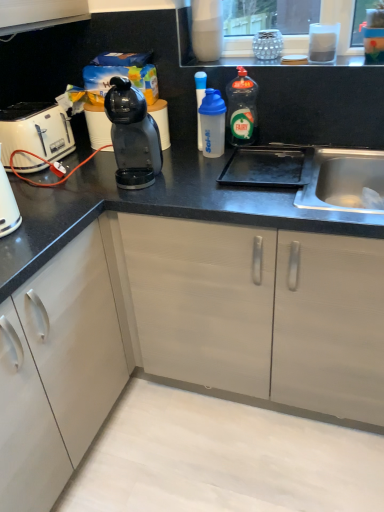
The height and width of the screenshot is (512, 384). Identify the location of transparent plastic bottle at center, which is the third bottle in left-to-right order. (242, 108).

What is the approximate width of transparent plastic bottle at center, the first bottle from the right?

3.23 inches.

The image size is (384, 512). Find the location of `transparent plastic shaker at center, marked as the 3th bottle in a right-to-left arrangement`. transparent plastic shaker at center, marked as the 3th bottle in a right-to-left arrangement is located at coordinates (200, 102).

Consider the image. Measure the distance between point (152, 148) and camera.

Point (152, 148) and camera are 4.61 feet apart.

The width and height of the screenshot is (384, 512). What are the coordinates of `transparent plastic bottle at center, the first bottle from the right` in the screenshot? It's located at (242, 108).

The image size is (384, 512). In the image, there is a white plastic shaker at center, which is counted as the second bottle, starting from the left. Identify the location of home appliance below it (from the image's perspective). (36, 131).

Considering the relative positions of white plastic shaker at center, the 2th bottle viewed from the right, and white plastic toaster at left in the image provided, is white plastic shaker at center, the 2th bottle viewed from the right, to the left or to the right of white plastic toaster at left?

Based on their positions, white plastic shaker at center, the 2th bottle viewed from the right, is located to the right of white plastic toaster at left.

Choose the correct answer: Is white plastic shaker at center, which is counted as the second bottle, starting from the left, inside white plastic toaster at left or outside it?

white plastic shaker at center, which is counted as the second bottle, starting from the left, is spatially situated outside white plastic toaster at left.

From the image's perspective, is white plastic shaker at center, which is counted as the second bottle, starting from the left, above or below white plastic toaster at left?

Based on their image positions, white plastic shaker at center, which is counted as the second bottle, starting from the left, is located above white plastic toaster at left.

Can we say transparent plastic shaker at center, marked as the 3th bottle in a right-to-left arrangement, lies outside black plastic coffee machine at center?

Yes, transparent plastic shaker at center, marked as the 3th bottle in a right-to-left arrangement, is not within black plastic coffee machine at center.

Can you confirm if transparent plastic shaker at center, which is the first bottle in left-to-right order, is thinner than black plastic coffee machine at center?

Yes.

Considering the points (204, 84) and (122, 89), which point is in front, point (204, 84) or point (122, 89)?

The point (122, 89) is closer to the camera.

Is transparent plastic shaker at center, which is the first bottle in left-to-right order, placed right next to black plastic coffee machine at center?

No.

Is white plastic shaker at center, which is counted as the second bottle, starting from the left, further to the viewer compared to transparent plastic bottle at center, the first bottle from the right?

No, it is not.

Considering the sizes of white plastic shaker at center, the 2th bottle viewed from the right, and transparent plastic bottle at center, the first bottle from the right, in the image, is white plastic shaker at center, the 2th bottle viewed from the right, taller or shorter than transparent plastic bottle at center, the first bottle from the right,?

In the image, white plastic shaker at center, the 2th bottle viewed from the right, appears to be shorter than transparent plastic bottle at center, the first bottle from the right.

Is white plastic shaker at center, the 2th bottle viewed from the right, not within transparent plastic bottle at center, which is the third bottle in left-to-right order?

Yes, white plastic shaker at center, the 2th bottle viewed from the right, is outside of transparent plastic bottle at center, which is the third bottle in left-to-right order.

How many degrees apart are the facing directions of white plastic shaker at center, the 2th bottle viewed from the right, and transparent plastic bottle at center, which is the third bottle in left-to-right order?

The angle between the facing direction of white plastic shaker at center, the 2th bottle viewed from the right, and the facing direction of transparent plastic bottle at center, which is the third bottle in left-to-right order, is 0.0054 degrees.

At what (x,y) coordinates should I click in order to perform the action: click on home appliance in front of the transparent plastic shaker at center, which is the first bottle in left-to-right order. Please return your answer as a coordinate pair (x, y). The image size is (384, 512). Looking at the image, I should click on (36, 131).

Consider the image. Could you measure the distance between transparent plastic shaker at center, marked as the 3th bottle in a right-to-left arrangement, and white plastic toaster at left?

They are 22.93 inches apart.

Can you confirm if transparent plastic shaker at center, which is the first bottle in left-to-right order, is taller than white plastic toaster at left?

Indeed, transparent plastic shaker at center, which is the first bottle in left-to-right order, has a greater height compared to white plastic toaster at left.

From the image's perspective, who appears lower, transparent plastic shaker at center, which is the first bottle in left-to-right order, or white plastic toaster at left?

white plastic toaster at left appears lower in the image.

Could you tell me if white plastic toaster at left is facing transparent plastic shaker at center, marked as the 3th bottle in a right-to-left arrangement?

Yes, white plastic toaster at left faces towards transparent plastic shaker at center, marked as the 3th bottle in a right-to-left arrangement.

Is white plastic toaster at left not within transparent plastic shaker at center, marked as the 3th bottle in a right-to-left arrangement?

Absolutely, white plastic toaster at left is external to transparent plastic shaker at center, marked as the 3th bottle in a right-to-left arrangement.

From a real-world perspective, which object rests below the other?

white plastic toaster at left is physically lower.

Does white plastic toaster at left appear on the right side of transparent plastic shaker at center, marked as the 3th bottle in a right-to-left arrangement?

Incorrect, white plastic toaster at left is not on the right side of transparent plastic shaker at center, marked as the 3th bottle in a right-to-left arrangement.

From the image's perspective, who appears lower, white plastic toaster at left or white plastic shaker at center, which is counted as the second bottle, starting from the left?

white plastic toaster at left is shown below in the image.

From a real-world perspective, is white plastic toaster at left positioned over white plastic shaker at center, the 2th bottle viewed from the right, based on gravity?

No, from a real-world perspective, white plastic toaster at left is not above white plastic shaker at center, the 2th bottle viewed from the right.

How far apart are white plastic toaster at left and white plastic shaker at center, the 2th bottle viewed from the right?

They are 23.13 inches apart.

Where is `home appliance lying in front of the white plastic shaker at center, which is counted as the second bottle, starting from the left`? home appliance lying in front of the white plastic shaker at center, which is counted as the second bottle, starting from the left is located at coordinates (36, 131).

What's the angular difference between black plastic coffee machine at center and transparent plastic shaker at center, which is the first bottle in left-to-right order,'s facing directions?

The angle between the facing direction of black plastic coffee machine at center and the facing direction of transparent plastic shaker at center, which is the first bottle in left-to-right order, is 5.1 degrees.

Is point (132, 172) farther from viewer compared to point (197, 125)?

No, (132, 172) is in front of (197, 125).

Consider the image. Does black plastic coffee machine at center turn towards transparent plastic shaker at center, which is the first bottle in left-to-right order?

No, black plastic coffee machine at center is not turned towards transparent plastic shaker at center, which is the first bottle in left-to-right order.

Does black plastic coffee machine at center appear on the left side of transparent plastic shaker at center, which is the first bottle in left-to-right order?

Yes.

Starting from the white plastic toaster at left, which bottle is the 2nd one to the right? Please provide its 2D coordinates.

[(212, 123)]

Locate an element on the screen. the 3rd bottle behind the black plastic coffee machine at center, starting your count from the anchor is located at coordinates (200, 102).

Considering their positions, is white plastic toaster at left positioned further to transparent plastic shaker at center, which is the first bottle in left-to-right order, than black plastic coffee machine at center?

white plastic toaster at left.

Looking at the image, which one is located closer to black plastic coffee machine at center, white plastic shaker at center, which is counted as the second bottle, starting from the left, or transparent plastic bottle at center, which is the third bottle in left-to-right order?

The object closer to black plastic coffee machine at center is white plastic shaker at center, which is counted as the second bottle, starting from the left.

Looking at the image, which one is located further to transparent plastic bottle at center, the first bottle from the right, white plastic shaker at center, which is counted as the second bottle, starting from the left, or white plastic toaster at left?

The object further to transparent plastic bottle at center, the first bottle from the right, is white plastic toaster at left.

Considering their positions, is white plastic toaster at left positioned closer to black plastic coffee machine at center than transparent plastic bottle at center, the first bottle from the right?

The object closer to black plastic coffee machine at center is white plastic toaster at left.

In the scene shown: Which object lies nearer to the anchor point white plastic shaker at center, which is counted as the second bottle, starting from the left, white plastic toaster at left or transparent plastic bottle at center, which is the third bottle in left-to-right order?

Among the two, transparent plastic bottle at center, which is the third bottle in left-to-right order, is located nearer to white plastic shaker at center, which is counted as the second bottle, starting from the left.

From the image, which object appears to be farther from transparent plastic bottle at center, the first bottle from the right, transparent plastic shaker at center, marked as the 3th bottle in a right-to-left arrangement, or black plastic coffee machine at center?

The object further to transparent plastic bottle at center, the first bottle from the right, is black plastic coffee machine at center.

From the image, which object appears to be nearer to black plastic coffee machine at center, transparent plastic bottle at center, the first bottle from the right, or transparent plastic shaker at center, which is the first bottle in left-to-right order?

The object closer to black plastic coffee machine at center is transparent plastic shaker at center, which is the first bottle in left-to-right order.

Estimate the real-world distances between objects in this image. Which object is closer to white plastic toaster at left, white plastic shaker at center, the 2th bottle viewed from the right, or transparent plastic bottle at center, which is the third bottle in left-to-right order?

white plastic shaker at center, the 2th bottle viewed from the right, is positioned closer to the anchor white plastic toaster at left.

This screenshot has width=384, height=512. In order to click on kitchen appliance between white plastic toaster at left and transparent plastic shaker at center, marked as the 3th bottle in a right-to-left arrangement in this screenshot , I will do `click(133, 136)`.

Where is `bottle between white plastic toaster at left and white plastic shaker at center, the 2th bottle viewed from the right, from left to right`? The height and width of the screenshot is (512, 384). bottle between white plastic toaster at left and white plastic shaker at center, the 2th bottle viewed from the right, from left to right is located at coordinates (200, 102).

Locate an element on the screen. The height and width of the screenshot is (512, 384). bottle between transparent plastic shaker at center, marked as the 3th bottle in a right-to-left arrangement, and transparent plastic bottle at center, which is the third bottle in left-to-right order, from left to right is located at coordinates (212, 123).

What are the coordinates of `kitchen appliance between white plastic toaster at left and transparent plastic bottle at center, which is the third bottle in left-to-right order, from left to right` in the screenshot? It's located at (133, 136).